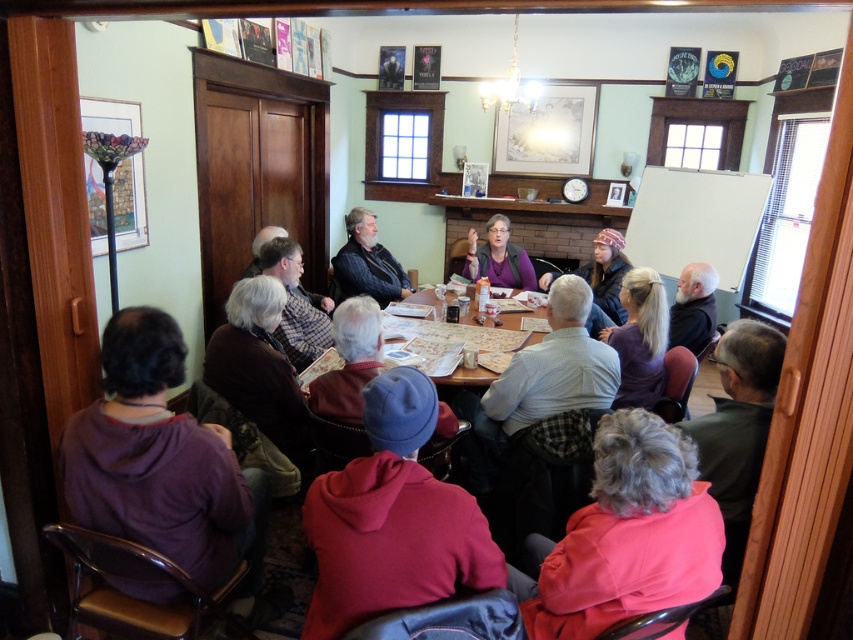
You are a guest at this gathering and want to pick up your red fleece jacket at center. However, there is a dark gray sweater at center in the way. Can you reach your jacket without moving the sweater?

The red fleece jacket at center is positioned under the dark gray sweater at center, so you can reach it by moving the sweater aside or lifting it to access the jacket beneath.